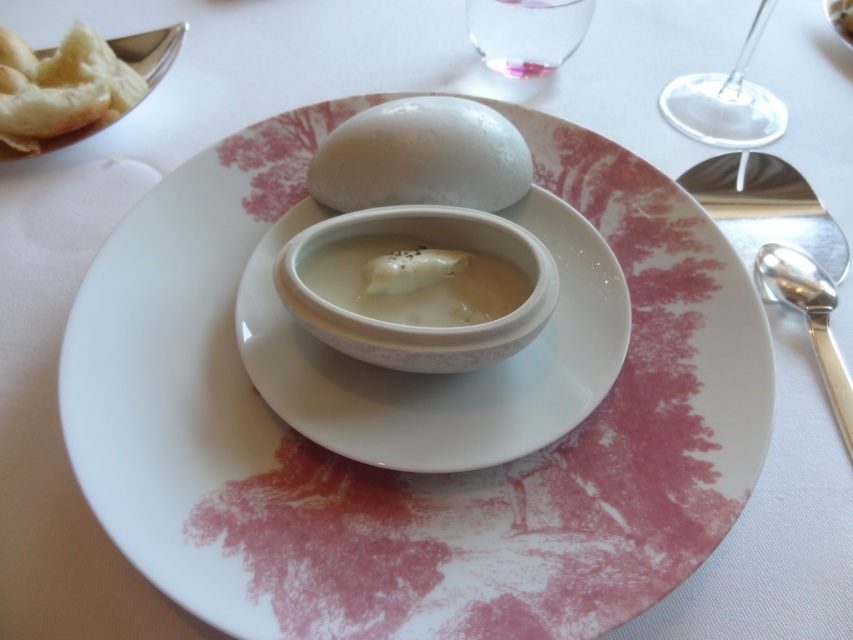
The width and height of the screenshot is (853, 640). I want to click on transparent glass at upper right, so click(726, 100).

Identify the location of transparent glass at upper right. (726, 100).

Can you confirm if white glossy plate at center is taller than silver metallic spoon at right?

Yes.

Find the location of a particular element. This screenshot has height=640, width=853. white glossy plate at center is located at coordinates (399, 472).

Is white matte egg at center smaller than white creamy gravy at center?

Incorrect, white matte egg at center is not smaller in size than white creamy gravy at center.

Between white matte egg at center and white creamy gravy at center, which one appears on the left side from the viewer's perspective?

white creamy gravy at center is more to the left.

Who is more forward, (x=360, y=128) or (x=485, y=268)?

Positioned in front is point (x=485, y=268).

Where is `white matte egg at center`? white matte egg at center is located at coordinates (421, 157).